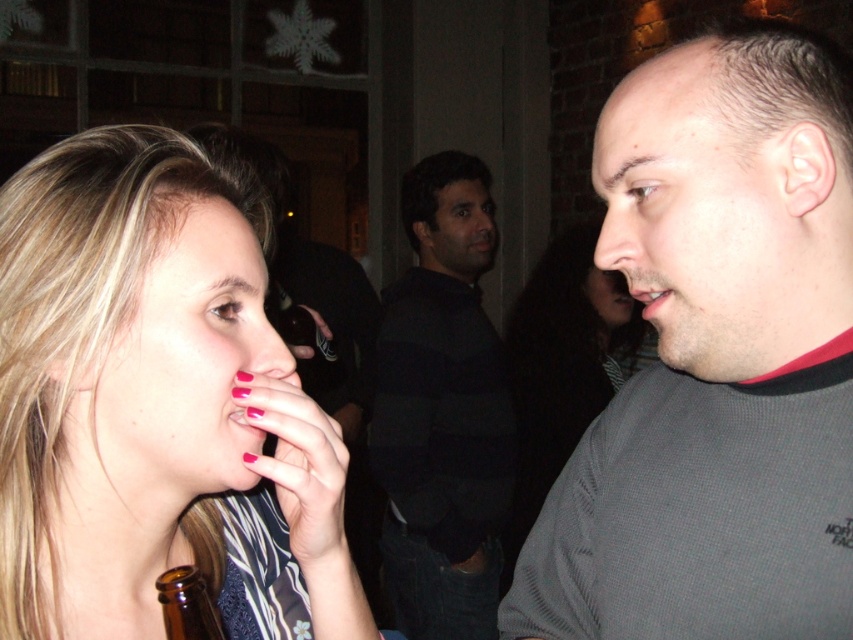
Question: Does matte gray nose at center appear over pink glossy lips at center?

Choices:
 (A) yes
 (B) no

Answer: (A)

Question: Based on their relative distances, which object is farther from the translucent glass bottle at center?

Choices:
 (A) smooth skin face at center
 (B) pink glossy lips at center
 (C) brown glass bottle at lower left

Answer: (C)

Question: Which object is closer to the camera taking this photo?

Choices:
 (A) pink nail polish at mouth
 (B) matte pink nose at center

Answer: (A)

Question: Is the position of pink glossy lips at center less distant than that of smooth skin at center?

Choices:
 (A) no
 (B) yes

Answer: (B)

Question: Can you confirm if matte gray nose at center is positioned above matte pink nose at center?

Choices:
 (A) no
 (B) yes

Answer: (B)

Question: Which object is positioned farthest from the matte pink nose at center?

Choices:
 (A) smooth skin at center
 (B) smooth skin face at center
 (C) matte black nose at center
 (D) gray fabric shirt at center

Answer: (D)